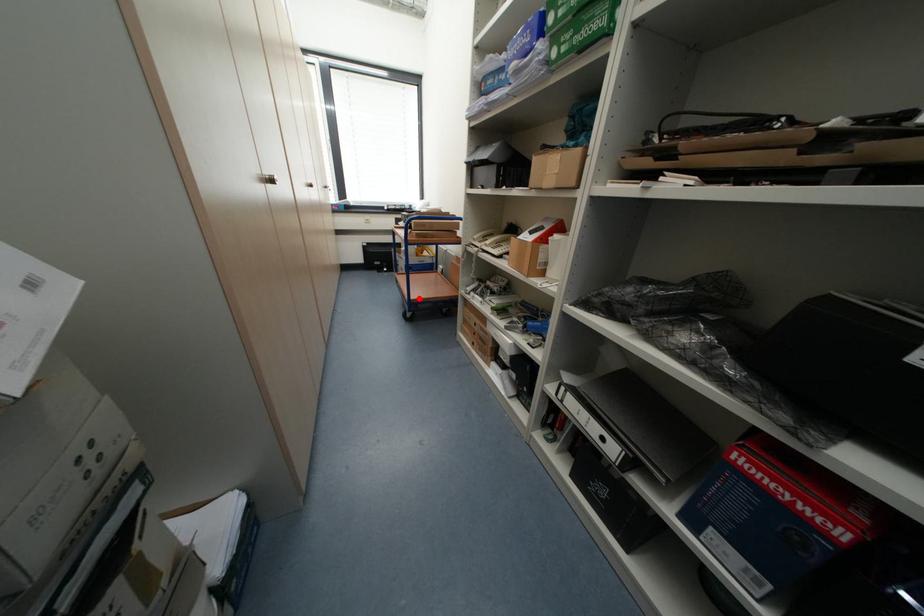
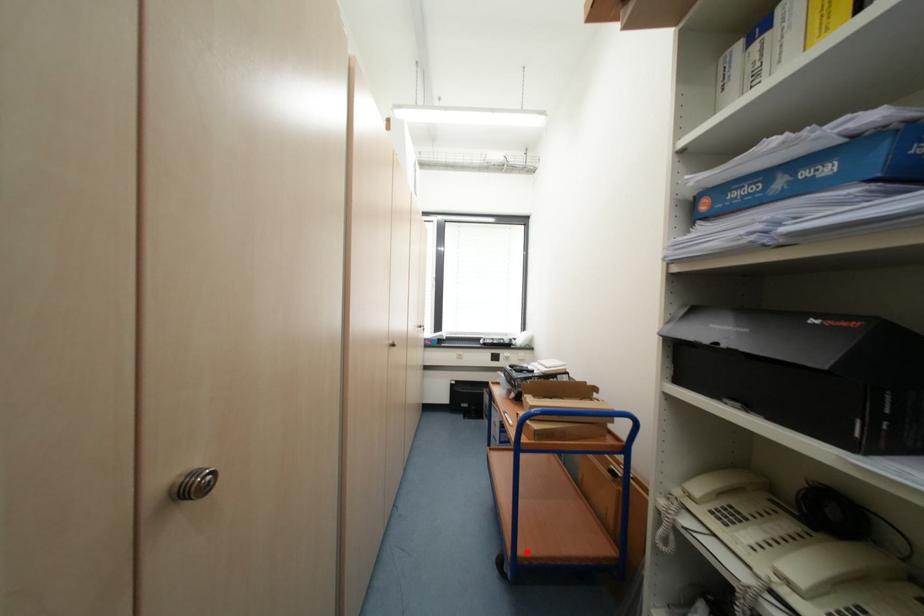
Looking at this image, I am providing you with two images of the same scene from different viewpoints. A red point is marked on the first image and another point is marked on the second image. Is the marked point in image1 the same physical position as the marked point in image2?

Yes